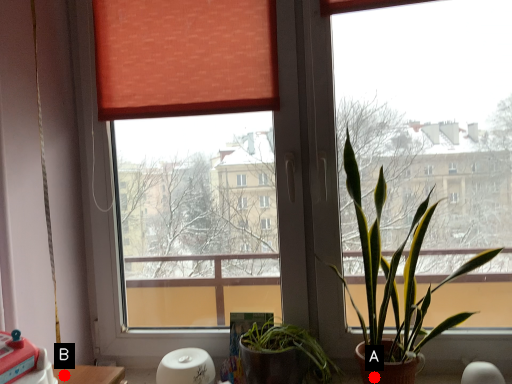
Question: Two points are circled on the image, labeled by A and B beside each circle. Which of the following is the farthest from the observer?

Choices:
 (A) A is further
 (B) B is further

Answer: (A)